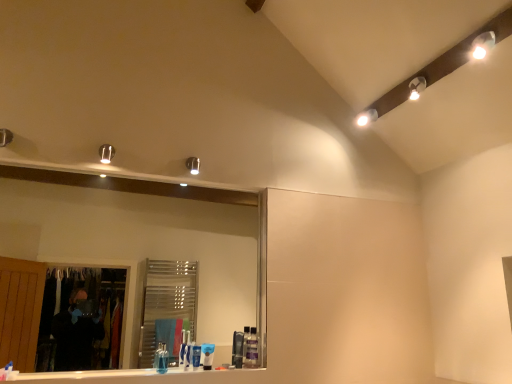
Describe the element at coordinates (251, 349) in the screenshot. The width and height of the screenshot is (512, 384). I see `translucent plastic container at lower center, which ranks as the fourth toiletry in left-to-right order` at that location.

Measure the distance between white glossy toothpaste at lower center, the 2th toothpaste when ordered from front to back, and camera.

The distance of white glossy toothpaste at lower center, the 2th toothpaste when ordered from front to back, from camera is 7.97 feet.

Identify the location of white glossy toothpaste at lower center, arranged as the second toothpaste when viewed from the left. (207, 355).

Describe the element at coordinates (6, 371) in the screenshot. I see `white glossy toothpaste at lower left, the first toothpaste when ordered from front to back` at that location.

This screenshot has height=384, width=512. What do you see at coordinates (367, 117) in the screenshot?
I see `white glossy light fixture at upper right` at bounding box center [367, 117].

Locate an element on the screen. white glossy light fixture at upper right is located at coordinates 367,117.

In order to face blue glossy toothpaste tube at lower center, which ranks as the first toiletry in left-to-right order, should I rotate leftwards or rightwards?

Rotate left and turn 12.362 degrees.

This screenshot has height=384, width=512. What do you see at coordinates (237, 349) in the screenshot?
I see `translucent plastic soap dispenser at center, acting as the 2th toiletry starting from the right` at bounding box center [237, 349].

What is the approximate height of blue matte toothpaste at center, placed as the third toiletry when sorted from right to left?

It is 5.85 inches.

Describe the element at coordinates (140, 242) in the screenshot. I see `clear glass mirror at center` at that location.

Identify the location of translucent plastic container at lower center, placed as the first toiletry when sorted from right to left. Image resolution: width=512 pixels, height=384 pixels. (251, 349).

Is white glossy toothpaste at lower left, the 1th toothpaste viewed from the left, a part of matte silver light fixture at upper left?

Actually, white glossy toothpaste at lower left, the 1th toothpaste viewed from the left, is outside matte silver light fixture at upper left.

What are the coordinates of `toothpaste on the left of matte silver light fixture at upper left` in the screenshot? It's located at (6, 371).

Is matte silver light fixture at upper left closer to camera compared to white glossy toothpaste at lower left, marked as the second toothpaste in a back-to-front arrangement?

No, it is not.

Is white glossy toothpaste at lower left, the first toothpaste when ordered from front to back, at the back of matte silver light fixture at upper left?

matte silver light fixture at upper left is not turned away from white glossy toothpaste at lower left, the first toothpaste when ordered from front to back.

From a real-world perspective, which object rests below the other?

white glossy toothpaste at lower left, the first toothpaste when ordered from front to back.

Is white glossy toothpaste at lower center, the 1th toothpaste positioned from the back, facing towards white glossy toothpaste at lower left, the first toothpaste when ordered from front to back?

No, white glossy toothpaste at lower center, the 1th toothpaste positioned from the back, is not aimed at white glossy toothpaste at lower left, the first toothpaste when ordered from front to back.

Considering the sizes of white glossy toothpaste at lower center, the 2th toothpaste when ordered from front to back, and white glossy toothpaste at lower left, marked as the second toothpaste in a back-to-front arrangement, in the image, is white glossy toothpaste at lower center, the 2th toothpaste when ordered from front to back, wider or thinner than white glossy toothpaste at lower left, marked as the second toothpaste in a back-to-front arrangement,?

Clearly, white glossy toothpaste at lower center, the 2th toothpaste when ordered from front to back, has less width compared to white glossy toothpaste at lower left, marked as the second toothpaste in a back-to-front arrangement.

From the picture: Who is smaller, white glossy toothpaste at lower center, the 2th toothpaste when ordered from front to back, or white glossy toothpaste at lower left, which appears as the 2th toothpaste when viewed from the right?

With smaller size is white glossy toothpaste at lower left, which appears as the 2th toothpaste when viewed from the right.

In the image, is translucent plastic soap dispenser at center, positioned as the 3th toiletry in left-to-right order, on the left side or the right side of translucent plastic container at lower center, which ranks as the fourth toiletry in left-to-right order?

Clearly, translucent plastic soap dispenser at center, positioned as the 3th toiletry in left-to-right order, is on the left of translucent plastic container at lower center, which ranks as the fourth toiletry in left-to-right order, in the image.

Between translucent plastic soap dispenser at center, positioned as the 3th toiletry in left-to-right order, and translucent plastic container at lower center, placed as the first toiletry when sorted from right to left, which one is positioned behind?

translucent plastic container at lower center, placed as the first toiletry when sorted from right to left, is further away from the camera.

From a real-world perspective, between translucent plastic soap dispenser at center, positioned as the 3th toiletry in left-to-right order, and translucent plastic container at lower center, which ranks as the fourth toiletry in left-to-right order, who is vertically higher?

translucent plastic container at lower center, which ranks as the fourth toiletry in left-to-right order.

Can you confirm if translucent plastic soap dispenser at center, acting as the 2th toiletry starting from the right, is smaller than translucent plastic container at lower center, which ranks as the fourth toiletry in left-to-right order?

Yes.

Is translucent plastic container at lower center, which ranks as the fourth toiletry in left-to-right order, oriented towards white glossy toothpaste at lower center, which ranks as the 1th toothpaste in right-to-left order?

No, translucent plastic container at lower center, which ranks as the fourth toiletry in left-to-right order, is not facing towards white glossy toothpaste at lower center, which ranks as the 1th toothpaste in right-to-left order.

Can you confirm if translucent plastic container at lower center, which ranks as the fourth toiletry in left-to-right order, is bigger than white glossy toothpaste at lower center, the 1th toothpaste positioned from the back?

Correct, translucent plastic container at lower center, which ranks as the fourth toiletry in left-to-right order, is larger in size than white glossy toothpaste at lower center, the 1th toothpaste positioned from the back.

Is translucent plastic container at lower center, placed as the first toiletry when sorted from right to left, next to white glossy toothpaste at lower center, the 1th toothpaste positioned from the back, and touching it?

translucent plastic container at lower center, placed as the first toiletry when sorted from right to left, is not next to white glossy toothpaste at lower center, the 1th toothpaste positioned from the back, and they're not touching.

Considering the relative sizes of translucent plastic container at lower center, which ranks as the fourth toiletry in left-to-right order, and white glossy toothpaste at lower center, arranged as the second toothpaste when viewed from the left, in the image provided, is translucent plastic container at lower center, which ranks as the fourth toiletry in left-to-right order, thinner than white glossy toothpaste at lower center, arranged as the second toothpaste when viewed from the left,?

In fact, translucent plastic container at lower center, which ranks as the fourth toiletry in left-to-right order, might be wider than white glossy toothpaste at lower center, arranged as the second toothpaste when viewed from the left.

Are translucent plastic soap dispenser at center, acting as the 2th toiletry starting from the right, and white glossy toothpaste at lower center, the 2th toothpaste when ordered from front to back, making contact?

No, translucent plastic soap dispenser at center, acting as the 2th toiletry starting from the right, is not next to white glossy toothpaste at lower center, the 2th toothpaste when ordered from front to back.

Which object is wider, translucent plastic soap dispenser at center, acting as the 2th toiletry starting from the right, or white glossy toothpaste at lower center, the 2th toothpaste when ordered from front to back?

translucent plastic soap dispenser at center, acting as the 2th toiletry starting from the right.

Would you say translucent plastic soap dispenser at center, acting as the 2th toiletry starting from the right, is to the left or to the right of white glossy toothpaste at lower center, the 2th toothpaste when ordered from front to back, in the picture?

Clearly, translucent plastic soap dispenser at center, acting as the 2th toiletry starting from the right, is on the right of white glossy toothpaste at lower center, the 2th toothpaste when ordered from front to back, in the image.

Does translucent plastic soap dispenser at center, acting as the 2th toiletry starting from the right, have a greater height compared to white glossy toothpaste at lower center, the 2th toothpaste when ordered from front to back?

Answer: Indeed, translucent plastic soap dispenser at center, acting as the 2th toiletry starting from the right, has a greater height compared to white glossy toothpaste at lower center, the 2th toothpaste when ordered from front to back.

Is point (240, 338) closer or farther from the camera than point (163, 366)?

Point (240, 338) is farther from the camera than point (163, 366).

At what (x,y) coordinates should I click in order to perform the action: click on the 2nd toiletry in front of the translucent plastic soap dispenser at center, acting as the 2th toiletry starting from the right, starting your count from the anchor. Please return your answer as a coordinate pair (x, y). The width and height of the screenshot is (512, 384). Looking at the image, I should click on [x=161, y=358].

From the picture: Between translucent plastic soap dispenser at center, acting as the 2th toiletry starting from the right, and blue glossy toothpaste tube at lower center, which ranks as the first toiletry in left-to-right order, which one is positioned behind?

translucent plastic soap dispenser at center, acting as the 2th toiletry starting from the right, is behind.

Considering the positions of point (249, 337) and point (206, 262), is point (249, 337) closer or farther from the camera than point (206, 262)?

Clearly, point (249, 337) is closer to the camera than point (206, 262).

Measure the distance between translucent plastic container at lower center, placed as the first toiletry when sorted from right to left, and clear glass mirror at center.

translucent plastic container at lower center, placed as the first toiletry when sorted from right to left, and clear glass mirror at center are 8.68 feet apart from each other.

Is translucent plastic container at lower center, which ranks as the fourth toiletry in left-to-right order, positioned with its back to clear glass mirror at center?

Yes, clear glass mirror at center is at the back of translucent plastic container at lower center, which ranks as the fourth toiletry in left-to-right order.

From a real-world perspective, which object rests below the other?

translucent plastic container at lower center, placed as the first toiletry when sorted from right to left.

Where is `toothpaste on the left of matte silver light fixture at upper left`? toothpaste on the left of matte silver light fixture at upper left is located at coordinates (6, 371).

Locate an element on the screen. The width and height of the screenshot is (512, 384). toothpaste that is above the white glossy toothpaste at lower left, marked as the second toothpaste in a back-to-front arrangement (from a real-world perspective) is located at coordinates (207, 355).

When comparing their distances from white glossy toothpaste at lower center, which ranks as the 1th toothpaste in right-to-left order, does white glossy toothpaste at lower left, the 1th toothpaste viewed from the left, or white glossy light fixture at upper right seem closer?

white glossy toothpaste at lower left, the 1th toothpaste viewed from the left, is positioned closer to the anchor white glossy toothpaste at lower center, which ranks as the 1th toothpaste in right-to-left order.

Estimate the real-world distances between objects in this image. Which object is further from white glossy toothpaste at lower center, the 2th toothpaste when ordered from front to back, blue matte toothpaste at center, placed as the third toiletry when sorted from right to left, or translucent plastic container at lower center, placed as the first toiletry when sorted from right to left?

translucent plastic container at lower center, placed as the first toiletry when sorted from right to left, is further to white glossy toothpaste at lower center, the 2th toothpaste when ordered from front to back.

Considering their positions, is translucent plastic container at lower center, which ranks as the fourth toiletry in left-to-right order, positioned further to white glossy toothpaste at lower left, which appears as the 2th toothpaste when viewed from the right, than blue matte toothpaste at center, the second toiletry from the left?

translucent plastic container at lower center, which ranks as the fourth toiletry in left-to-right order, lies further to white glossy toothpaste at lower left, which appears as the 2th toothpaste when viewed from the right, than the other object.

Estimate the real-world distances between objects in this image. Which object is closer to translucent plastic container at lower center, placed as the first toiletry when sorted from right to left, white glossy light fixture at upper right or clear glass mirror at center?

The object closer to translucent plastic container at lower center, placed as the first toiletry when sorted from right to left, is white glossy light fixture at upper right.

Considering their positions, is clear glass mirror at center positioned further to white glossy toothpaste at lower center, arranged as the second toothpaste when viewed from the left, than translucent plastic container at lower center, which ranks as the fourth toiletry in left-to-right order?

Among the two, clear glass mirror at center is located further to white glossy toothpaste at lower center, arranged as the second toothpaste when viewed from the left.

Which object lies further to the anchor point translucent plastic container at lower center, which ranks as the fourth toiletry in left-to-right order, blue glossy toothpaste tube at lower center, which is the 4th toiletry in right-to-left order, or blue matte toothpaste at center, the second toiletry from the left?

blue glossy toothpaste tube at lower center, which is the 4th toiletry in right-to-left order.

Estimate the real-world distances between objects in this image. Which object is closer to white glossy toothpaste at lower left, the 1th toothpaste viewed from the left, translucent plastic soap dispenser at center, acting as the 2th toiletry starting from the right, or matte silver light fixture at upper left?

Based on the image, translucent plastic soap dispenser at center, acting as the 2th toiletry starting from the right, appears to be nearer to white glossy toothpaste at lower left, the 1th toothpaste viewed from the left.

From the image, which object appears to be farther from blue glossy toothpaste tube at lower center, which ranks as the first toiletry in left-to-right order, translucent plastic container at lower center, which ranks as the fourth toiletry in left-to-right order, or white glossy toothpaste at lower left, which appears as the 2th toothpaste when viewed from the right?

Among the two, white glossy toothpaste at lower left, which appears as the 2th toothpaste when viewed from the right, is located further to blue glossy toothpaste tube at lower center, which ranks as the first toiletry in left-to-right order.

The width and height of the screenshot is (512, 384). I want to click on toiletry between white glossy toothpaste at lower center, which ranks as the 1th toothpaste in right-to-left order, and translucent plastic container at lower center, which ranks as the fourth toiletry in left-to-right order, so click(x=237, y=349).

Find the location of a particular element. This screenshot has height=384, width=512. light fixture located between white glossy toothpaste at lower left, which appears as the 2th toothpaste when viewed from the right, and white glossy light fixture at upper right in the left-right direction is located at coordinates (106, 153).

The image size is (512, 384). Identify the location of toiletry between white glossy toothpaste at lower left, the first toothpaste when ordered from front to back, and blue matte toothpaste at center, placed as the third toiletry when sorted from right to left, in the horizontal direction. (161, 358).

Locate an element on the screen. toothpaste between clear glass mirror at center and translucent plastic soap dispenser at center, positioned as the 3th toiletry in left-to-right order, in the horizontal direction is located at coordinates (207, 355).